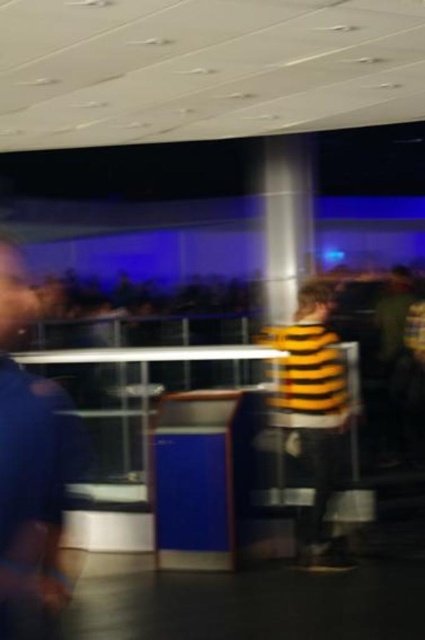
The width and height of the screenshot is (425, 640). Describe the element at coordinates (30, 470) in the screenshot. I see `blue fabric shirt at left` at that location.

Does blue fabric shirt at left have a smaller size compared to yellow striped shirt at center?

Indeed, blue fabric shirt at left has a smaller size compared to yellow striped shirt at center.

Is point (79, 458) in front of point (272, 340)?

Yes, point (79, 458) is in front of point (272, 340).

Image resolution: width=425 pixels, height=640 pixels. I want to click on blue fabric shirt at left, so click(x=30, y=470).